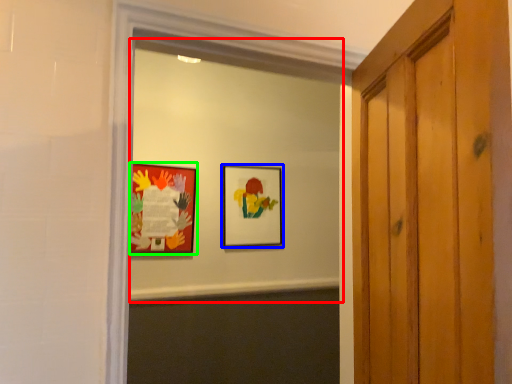
Question: Estimate the real-world distances between objects in this image. Which object is farther from mirror (highlighted by a red box), picture frame (highlighted by a blue box) or picture frame (highlighted by a green box)?

Choices:
 (A) picture frame
 (B) picture frame

Answer: (B)